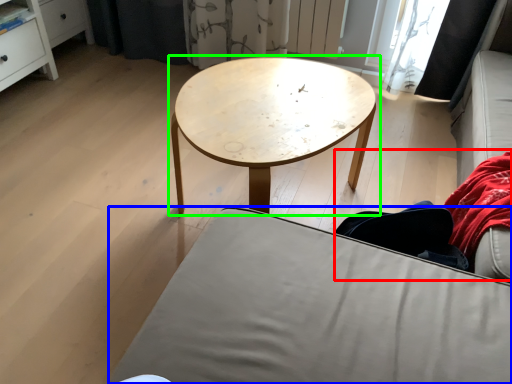
Question: Which object is the closest to the couple (highlighted by a red box)? Choose among these: studio couch (highlighted by a blue box) or coffee table (highlighted by a green box).

Choices:
 (A) studio couch
 (B) coffee table

Answer: (A)